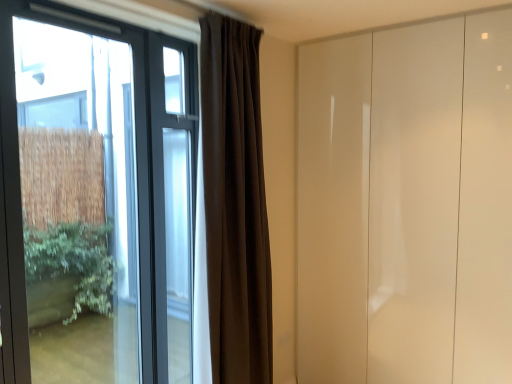
Identify the location of glossy white door at right. This screenshot has height=384, width=512. (406, 204).

Locate an element on the screen. dark matte curtain at center is located at coordinates (234, 204).

Find the location of `glossy white door at right`. glossy white door at right is located at coordinates (406, 204).

Does glossy white door at right come behind dark matte curtain at center?

Yes, the depth of glossy white door at right is greater than that of dark matte curtain at center.

Could you tell me if glossy white door at right is turned towards dark matte curtain at center?

Yes, glossy white door at right is facing dark matte curtain at center.

From the picture: Does glossy white door at right have a lesser height compared to dark matte curtain at center?

No.

What's the angular difference between clear glass window at left and dark matte curtain at center's facing directions?

3.49 degrees.

Looking at this image, based on their sizes in the image, would you say clear glass window at left is bigger or smaller than dark matte curtain at center?

In the image, clear glass window at left appears to be smaller than dark matte curtain at center.

Is clear glass window at left not close to dark matte curtain at center?

Absolutely, clear glass window at left is distant from dark matte curtain at center.

Would you say clear glass window at left is inside or outside dark matte curtain at center?

clear glass window at left exists outside the volume of dark matte curtain at center.

The image size is (512, 384). I want to click on window above the glossy white door at right (from the image's perspective), so click(95, 198).

Which object is positioned more to the right, clear glass window at left or glossy white door at right?

From the viewer's perspective, glossy white door at right appears more on the right side.

Based on the photo, which object is wider, clear glass window at left or glossy white door at right?

Wider between the two is glossy white door at right.

From a real-world perspective, does clear glass window at left stand above glossy white door at right?

Yes.

Locate an element on the screen. The width and height of the screenshot is (512, 384). door below the dark matte curtain at center (from a real-world perspective) is located at coordinates (406, 204).

Are dark matte curtain at center and glossy white door at right making contact?

No, dark matte curtain at center is not in contact with glossy white door at right.

Is glossy white door at right located within dark matte curtain at center?

No, glossy white door at right is located outside of dark matte curtain at center.

Which of these two, dark matte curtain at center or clear glass window at left, stands shorter?

Standing shorter between the two is clear glass window at left.

From a real-world perspective, is dark matte curtain at center beneath clear glass window at left?

No, from a real-world perspective, dark matte curtain at center is not beneath clear glass window at left.

Is the surface of dark matte curtain at center in direct contact with clear glass window at left?

They are not placed beside each other.

Between point (326, 107) and point (22, 17), which one is positioned in front?

Positioned in front is point (22, 17).

From the image's perspective, is glossy white door at right located above clear glass window at left?

No, from the image's perspective, glossy white door at right is not over clear glass window at left.

From a real-world perspective, is glossy white door at right above or below clear glass window at left?

glossy white door at right is below clear glass window at left.

In the image, is glossy white door at right positioned in front of or behind clear glass window at left?

In the image, glossy white door at right appears behind clear glass window at left.

Identify the location of door that appears on the right of dark matte curtain at center. (406, 204).

In order to click on curtain that appears above the clear glass window at left (from the image's perspective) in this screenshot , I will do `click(234, 204)`.

Based on their spatial positions, is glossy white door at right or dark matte curtain at center further from clear glass window at left?

Among the two, glossy white door at right is located further to clear glass window at left.

Considering their positions, is glossy white door at right positioned closer to dark matte curtain at center than clear glass window at left?

Based on the image, glossy white door at right appears to be nearer to dark matte curtain at center.

Based on their spatial positions, is dark matte curtain at center or clear glass window at left further from glossy white door at right?

Among the two, clear glass window at left is located further to glossy white door at right.

Considering their positions, is clear glass window at left positioned further to glossy white door at right than dark matte curtain at center?

Among the two, clear glass window at left is located further to glossy white door at right.

Looking at the image, which one is located closer to dark matte curtain at center, clear glass window at left or glossy white door at right?

glossy white door at right.

From the image, which object appears to be farther from clear glass window at left, dark matte curtain at center or glossy white door at right?

glossy white door at right is positioned further to the anchor clear glass window at left.

Locate an element on the screen. This screenshot has width=512, height=384. curtain between clear glass window at left and glossy white door at right from left to right is located at coordinates (234, 204).